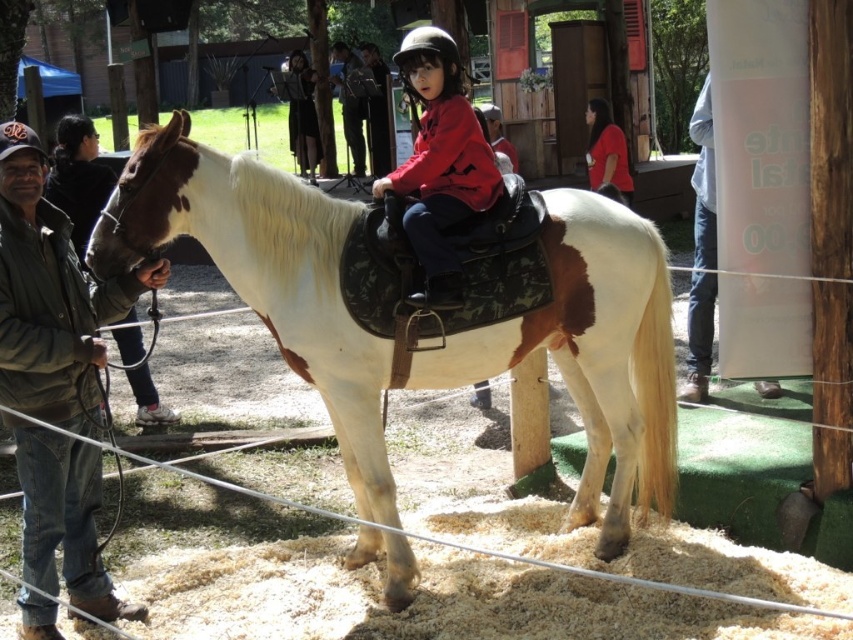
You are a photographer at the equestrian event and want to capture a photo of the red matte shirt at center and the green matte jacket at left. From the photographer perspective, which object is on the right side?

The red matte shirt at center is positioned on the right side of green matte jacket at left.

You are a photographer at an equestrian event. You need to capture a photo of the white leather horse at center and the green matte jacket at left. From the perspective of the photographer standing behind the horse, which object is closer to the camera?

The white leather horse at center is positioned over green matte jacket at left, so from the photographer standing behind the horse, the horse is closer to the camera than the jacket.

You are a photographer positioned at the center of the frame. You want to take a photo of the green matte jacket at left. Where should you aim your camera relative to the center of the frame?

The green matte jacket at left is located at point 0.278 on the horizontal axis and 0.093 on the vertical axis relative to the frame. Since you are at the center, you should aim your camera slightly to the left and downward to capture the green matte jacket at left.